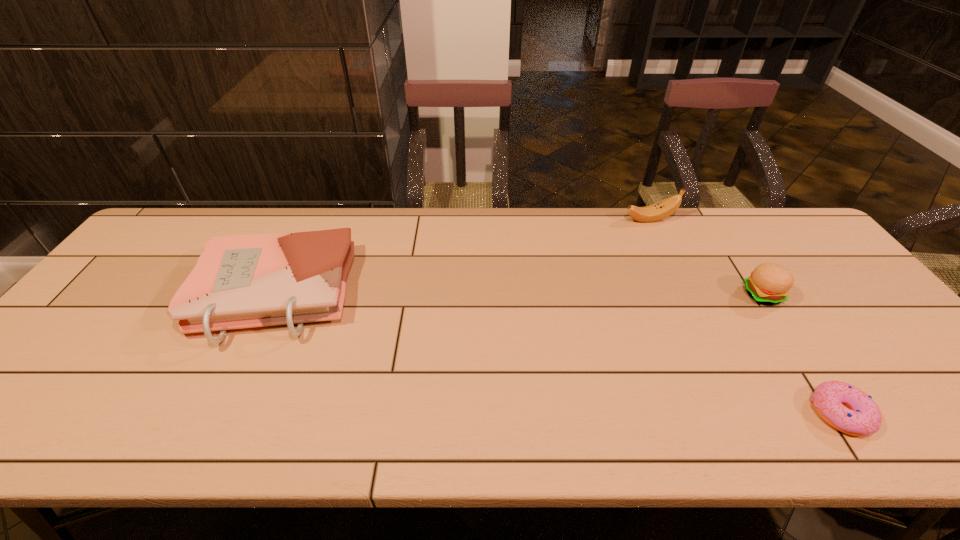
Identify the location of banana present at the far edge. The height and width of the screenshot is (540, 960). (664, 208).

This screenshot has width=960, height=540. I want to click on phonebook at the far edge, so click(240, 281).

At what (x,y) coordinates should I click in order to perform the action: click on object that is at the near edge. Please return your answer as a coordinate pair (x, y). The width and height of the screenshot is (960, 540). Looking at the image, I should click on (844, 407).

Locate an element on the screen. The width and height of the screenshot is (960, 540). vacant space at the far edge of the desktop is located at coordinates (689, 226).

You are a GUI agent. You are given a task and a screenshot of the screen. Output one action in this format:
    pyautogui.click(x=<x>, y=<y>)
    Task: Click on the vacant space at the near edge
    This screenshot has width=960, height=540.
    Given the screenshot: What is the action you would take?
    pyautogui.click(x=118, y=417)

Image resolution: width=960 pixels, height=540 pixels. Identify the location of free region at the left edge of the desktop. (78, 340).

Where is `free region at the right edge`? The image size is (960, 540). free region at the right edge is located at coordinates (862, 301).

The image size is (960, 540). I want to click on free space that is in between the doughnut and the leftmost object, so click(557, 354).

Image resolution: width=960 pixels, height=540 pixels. I want to click on vacant space that's between the leftmost object and the nearest object, so click(557, 354).

Where is `free space that is in between the banana and the hamburger`? The image size is (960, 540). free space that is in between the banana and the hamburger is located at coordinates (707, 257).